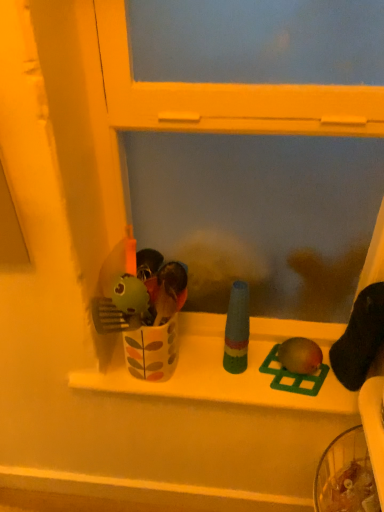
This screenshot has height=512, width=384. Find the location of `blank space to the left of multicolored plastic bottle at center, the 3th toy when ordered from right to left`. blank space to the left of multicolored plastic bottle at center, the 3th toy when ordered from right to left is located at coordinates (198, 364).